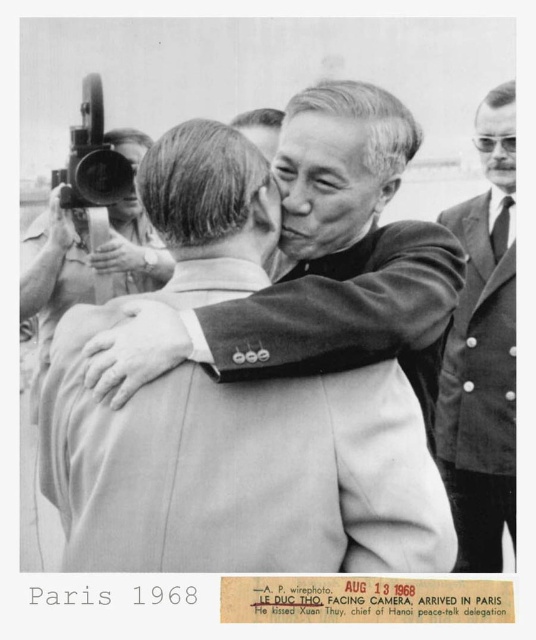
Question: Among these points, which one is nearest to the camera?

Choices:
 (A) (483, 211)
 (B) (410, 356)

Answer: (B)

Question: Is smooth suit at center behind smooth suit jacket at right?

Choices:
 (A) no
 (B) yes

Answer: (A)

Question: Is the position of smooth suit at center less distant than that of smooth suit jacket at right?

Choices:
 (A) yes
 (B) no

Answer: (A)

Question: Is smooth suit at center to the right of smooth suit jacket at right from the viewer's perspective?

Choices:
 (A) no
 (B) yes

Answer: (A)